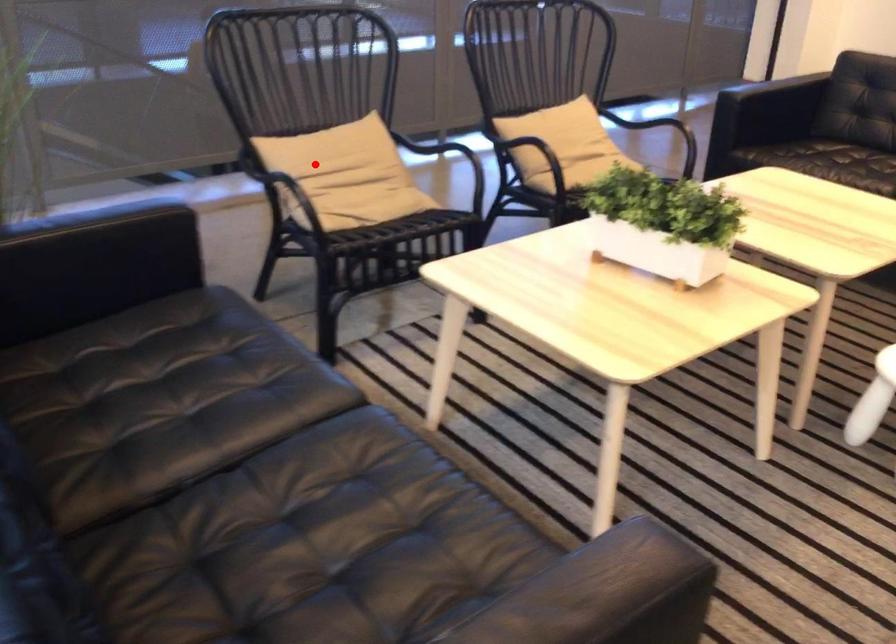
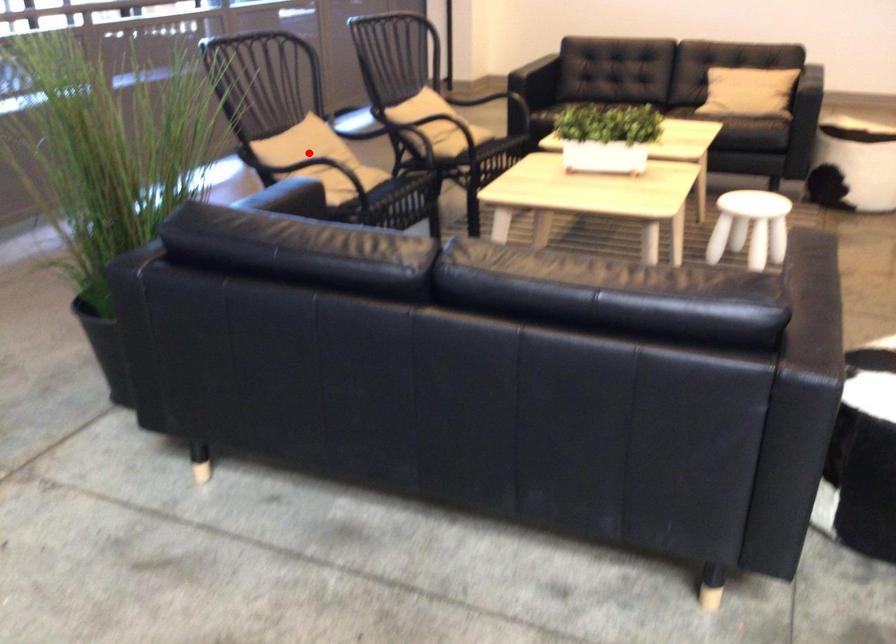
I am providing you with two images of the same scene from different viewpoints. A red point is marked on the first image and another point is marked on the second image. Is the marked point in image1 the same physical position as the marked point in image2?

Yes